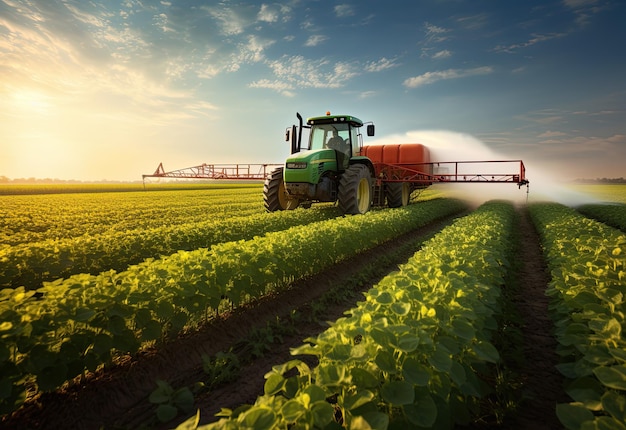
The height and width of the screenshot is (430, 626). Identify the location of window. (327, 140).